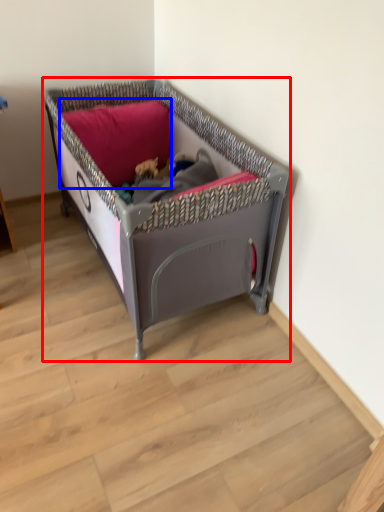
Question: Among these objects, which one is nearest to the camera, infant bed (highlighted by a red box) or pillow (highlighted by a blue box)?

Choices:
 (A) infant bed
 (B) pillow

Answer: (A)